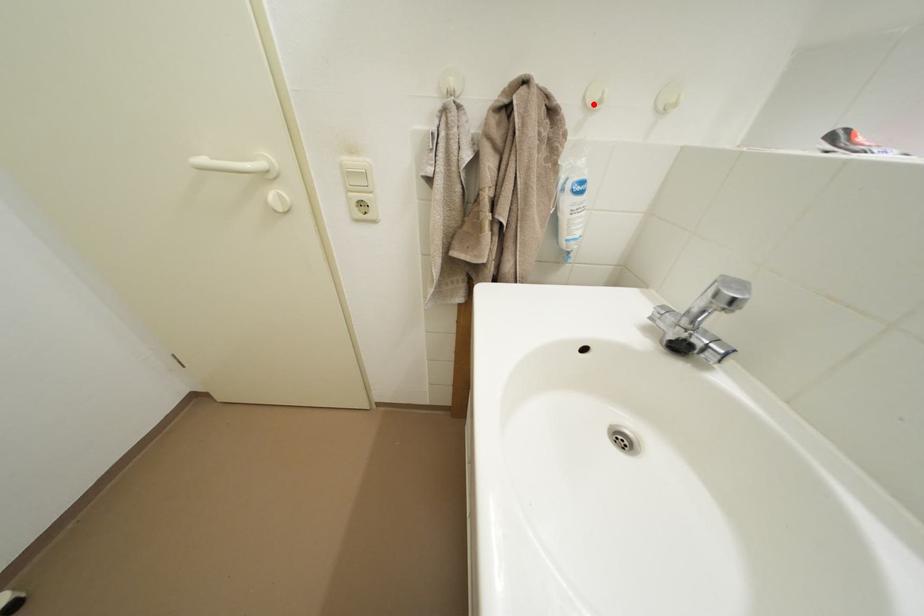
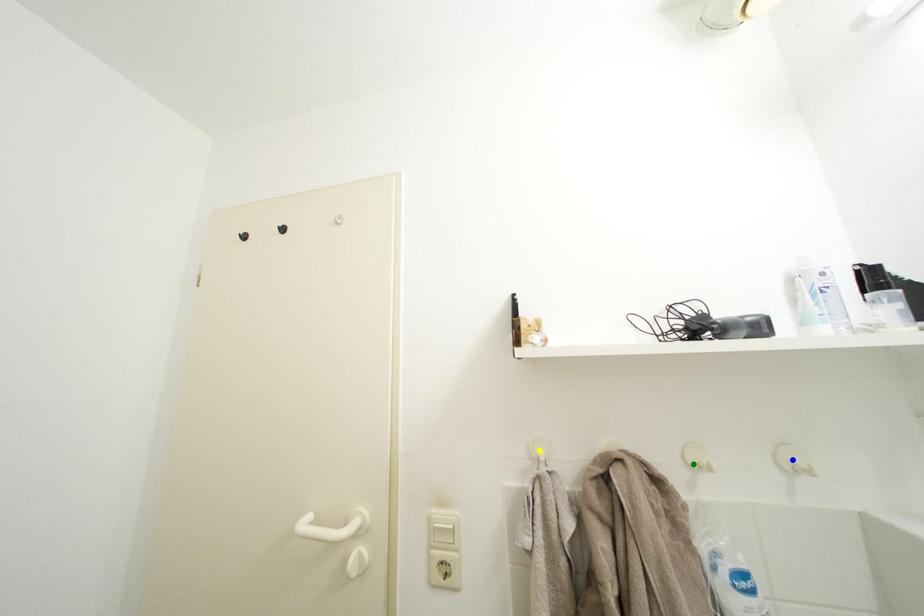
Question: I am providing you with two images of the same scene from different viewpoints. A red point is marked on the first image. You are given multiple points on the second image. In image 2, which mark is for the same physical point as the one in image 1?

Choices:
 (A) yellow point
 (B) blue point
 (C) green point

Answer: (C)